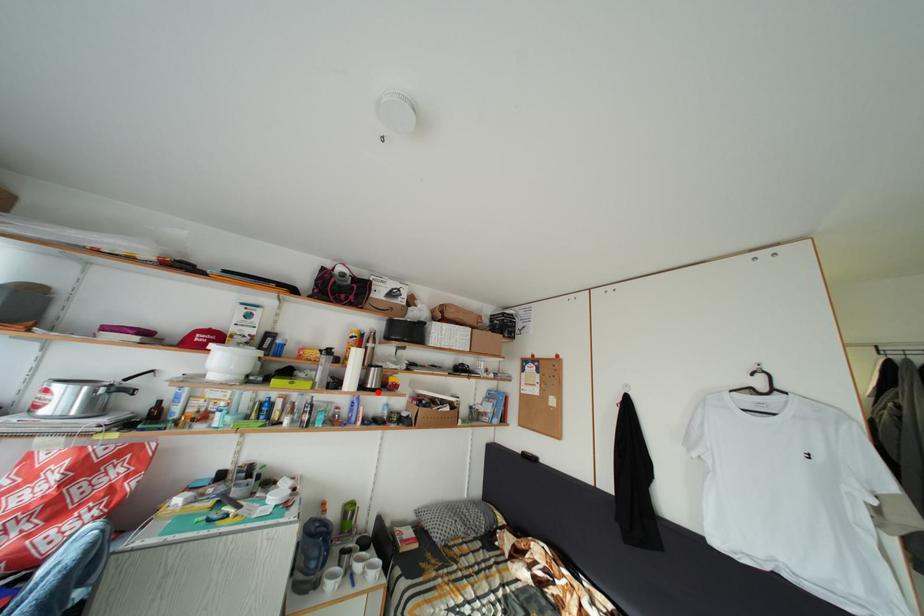
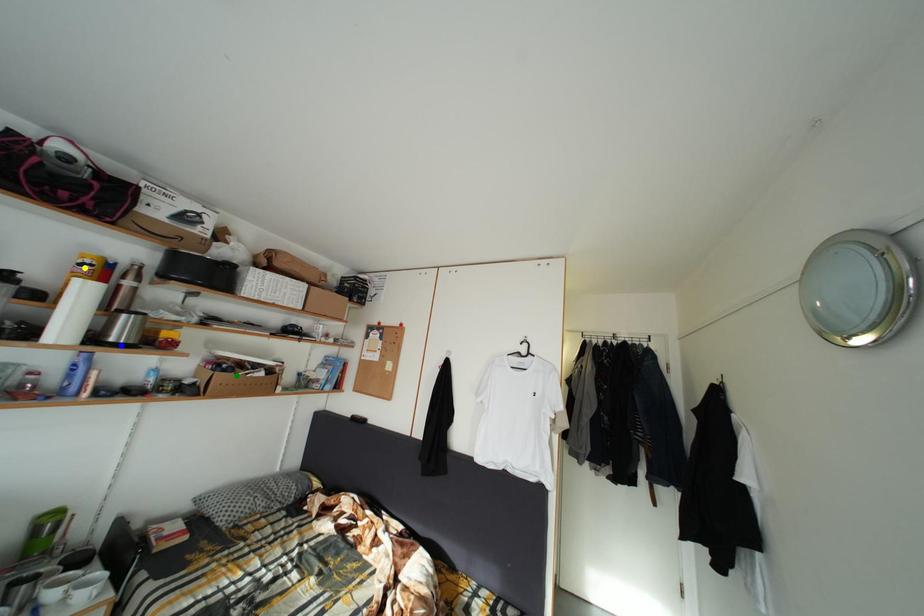
Question: I am providing you with two images of the same scene from different viewpoints. A red point is marked on the first image. You are given multiple points on the second image. Which point in image 2 represents the same 3d spot as the red point in image 1?

Choices:
 (A) yellow point
 (B) blue point
 (C) green point

Answer: (B)